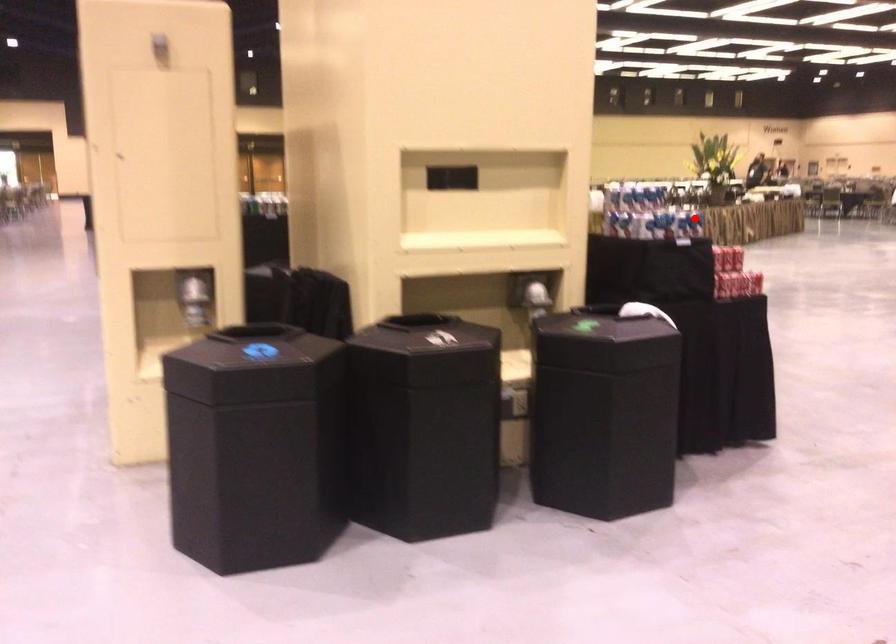
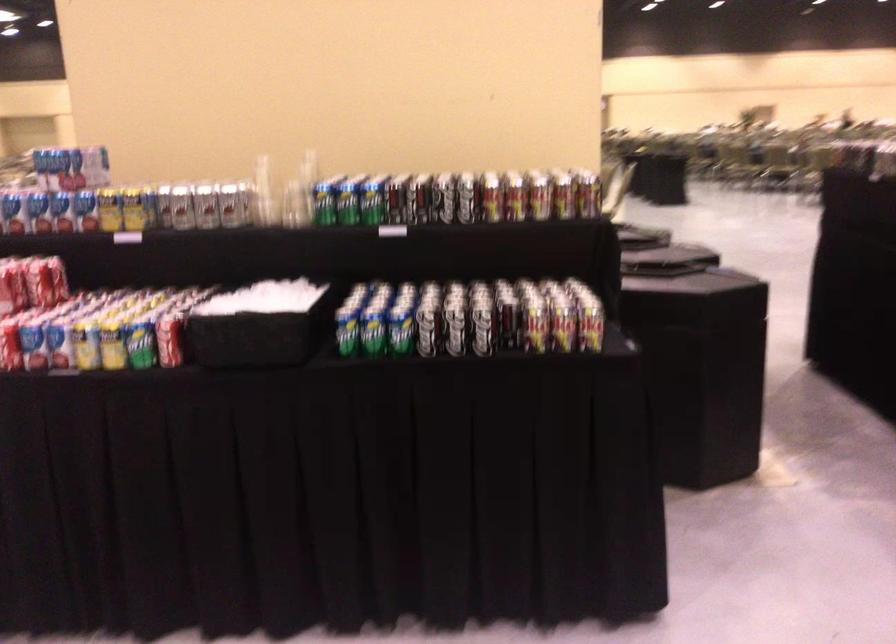
Where in the second image is the point corresponding to the highlighted location from the first image?

(13, 209)